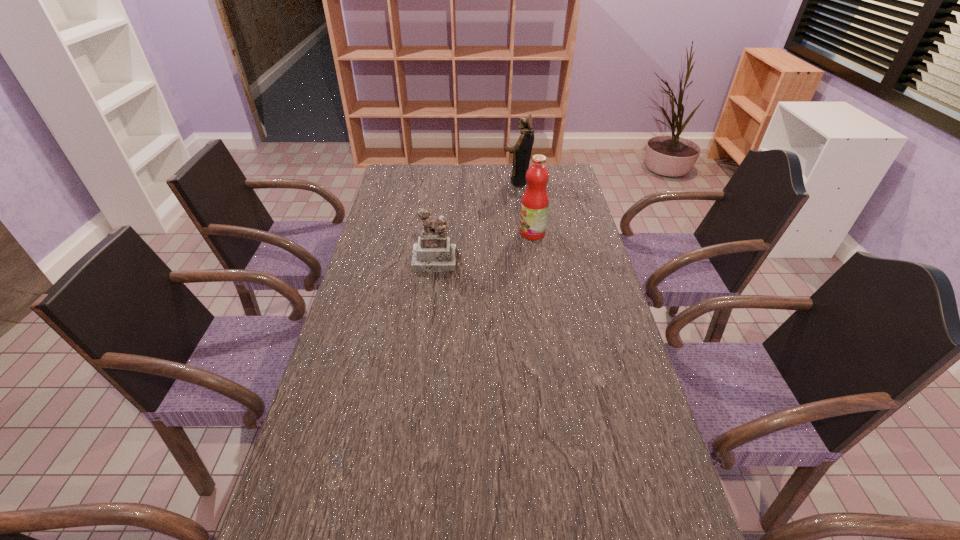
At what (x,y) coordinates should I click in order to perform the action: click on vacant region between the right figurine and the left figurine. Please return your answer as a coordinate pair (x, y). Image resolution: width=960 pixels, height=540 pixels. Looking at the image, I should click on (476, 221).

Locate an element on the screen. The height and width of the screenshot is (540, 960). vacant area that lies between the nearest object and the taller figurine is located at coordinates (476, 221).

Where is `object that is the second closest to the nearer figurine`? The image size is (960, 540). object that is the second closest to the nearer figurine is located at coordinates (522, 149).

Choose which object is the second nearest neighbor to the left figurine. Please provide its 2D coordinates. Your answer should be formatted as a tuple, i.e. [(x, y)], where the tuple contains the x and y coordinates of a point satisfying the conditions above.

[(522, 149)]

Find the location of `free space that satisfies the following two spatial constraints: 1. on the front-facing side of the farther figurine; 2. on the front-facing side of the nearer figurine`. free space that satisfies the following two spatial constraints: 1. on the front-facing side of the farther figurine; 2. on the front-facing side of the nearer figurine is located at coordinates (527, 261).